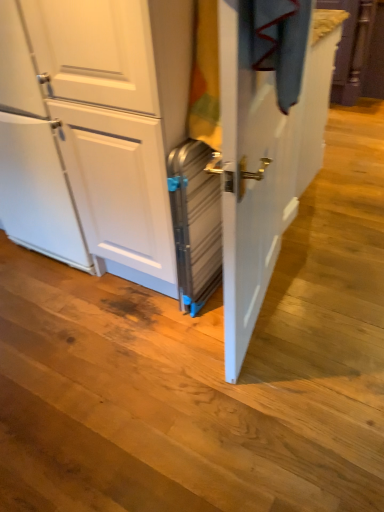
The height and width of the screenshot is (512, 384). What do you see at coordinates (251, 179) in the screenshot?
I see `metallic silver screen door at center` at bounding box center [251, 179].

The height and width of the screenshot is (512, 384). In order to click on metallic silver screen door at center in this screenshot , I will do `click(251, 179)`.

This screenshot has height=512, width=384. In order to click on metallic silver suitcase at center in this screenshot , I will do `click(195, 223)`.

What do you see at coordinates (195, 223) in the screenshot? The width and height of the screenshot is (384, 512). I see `metallic silver suitcase at center` at bounding box center [195, 223].

Where is `metallic silver screen door at center`? metallic silver screen door at center is located at coordinates (251, 179).

Considering the relative positions of metallic silver suitcase at center and metallic silver screen door at center in the image provided, is metallic silver suitcase at center to the left of metallic silver screen door at center from the viewer's perspective?

Yes.

Looking at this image, does metallic silver suitcase at center lie behind metallic silver screen door at center?

Yes.

Does point (187, 280) come in front of point (270, 224)?

Yes, it is in front of point (270, 224).

From the image's perspective, is metallic silver suitcase at center on top of metallic silver screen door at center?

No, from the image's perspective, metallic silver suitcase at center is not on top of metallic silver screen door at center.

From a real-world perspective, is metallic silver suitcase at center positioned above or below metallic silver screen door at center?

metallic silver suitcase at center is situated lower than metallic silver screen door at center in the real world.

Is metallic silver suitcase at center wider than metallic silver screen door at center?

Yes.

Can you confirm if metallic silver suitcase at center is taller than metallic silver screen door at center?

No, metallic silver suitcase at center is not taller than metallic silver screen door at center.

Is metallic silver suitcase at center bigger or smaller than metallic silver screen door at center?

metallic silver suitcase at center is smaller than metallic silver screen door at center.

Would you say metallic silver suitcase at center is outside metallic silver screen door at center?

That's correct, metallic silver suitcase at center is outside of metallic silver screen door at center.

Are metallic silver suitcase at center and metallic silver screen door at center beside each other?

No, metallic silver suitcase at center is not touching metallic silver screen door at center.

Could you tell me if metallic silver suitcase at center is facing metallic silver screen door at center?

No.

Locate an element on the screen. The image size is (384, 512). screen door that appears in front of the metallic silver suitcase at center is located at coordinates (251, 179).

Considering the relative positions of metallic silver screen door at center and metallic silver suitcase at center in the image provided, is metallic silver screen door at center to the left or to the right of metallic silver suitcase at center?

metallic silver screen door at center is to the right of metallic silver suitcase at center.

Considering the relative positions of metallic silver screen door at center and metallic silver suitcase at center in the image provided, is metallic silver screen door at center behind metallic silver suitcase at center?

No, the depth of metallic silver screen door at center is less than that of metallic silver suitcase at center.

Considering the positions of point (237, 127) and point (186, 141), is point (237, 127) closer or farther from the camera than point (186, 141)?

Point (237, 127) is closer to the camera than point (186, 141).

From the image's perspective, is metallic silver screen door at center under metallic silver suitcase at center?

Incorrect, from the image's perspective, metallic silver screen door at center is higher than metallic silver suitcase at center.

From a real-world perspective, does metallic silver screen door at center stand above metallic silver suitcase at center?

Yes, from a real-world perspective, metallic silver screen door at center is on top of metallic silver suitcase at center.

Looking at their sizes, would you say metallic silver screen door at center is wider or thinner than metallic silver suitcase at center?

Considering their sizes, metallic silver screen door at center looks slimmer than metallic silver suitcase at center.

Who is taller, metallic silver screen door at center or metallic silver suitcase at center?

Standing taller between the two is metallic silver screen door at center.

Considering the relative sizes of metallic silver screen door at center and metallic silver suitcase at center in the image provided, is metallic silver screen door at center smaller than metallic silver suitcase at center?

Incorrect, metallic silver screen door at center is not smaller in size than metallic silver suitcase at center.

Is metallic silver screen door at center situated inside metallic silver suitcase at center or outside?

metallic silver screen door at center is located beyond the bounds of metallic silver suitcase at center.

Is metallic silver screen door at center placed right next to metallic silver suitcase at center?

No, metallic silver screen door at center is not next to metallic silver suitcase at center.

Is metallic silver screen door at center oriented towards metallic silver suitcase at center?

Yes, metallic silver screen door at center is oriented towards metallic silver suitcase at center.

Based on the photo, how different are the orientations of metallic silver screen door at center and metallic silver suitcase at center in degrees?

99.1 degrees separate the facing orientations of metallic silver screen door at center and metallic silver suitcase at center.

Identify the location of appliance located behind the metallic silver screen door at center. (195, 223).

Where is `appliance on the left of metallic silver screen door at center`? appliance on the left of metallic silver screen door at center is located at coordinates (195, 223).

The height and width of the screenshot is (512, 384). In order to click on screen door lying above the metallic silver suitcase at center (from the image's perspective) in this screenshot , I will do `click(251, 179)`.